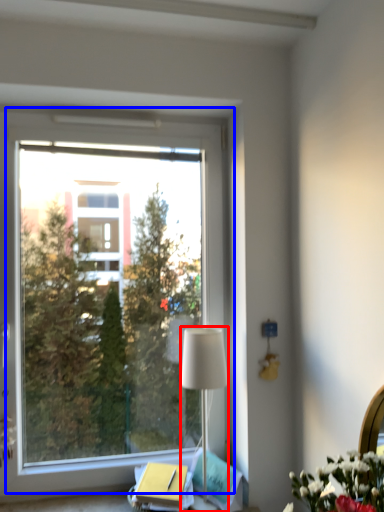
Question: Which of the following is the closest to the observer, lamp (highlighted by a red box) or window (highlighted by a blue box)?

Choices:
 (A) lamp
 (B) window

Answer: (A)